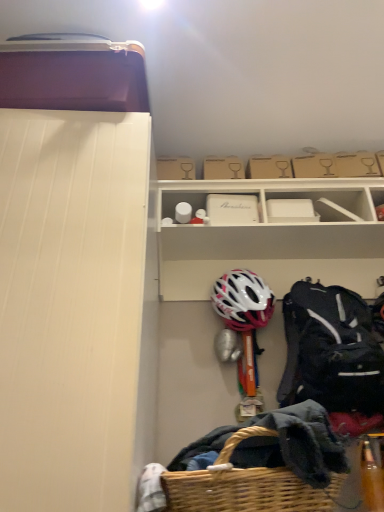
Question: Should I look upward or downward to see white matte helmet at center?

Choices:
 (A) up
 (B) down

Answer: (B)

Question: Does woven brown picnic basket at lower center appear on the left side of white matte storage box at upper center, the second storage box positioned from the top?

Choices:
 (A) no
 (B) yes

Answer: (B)

Question: Does woven brown picnic basket at lower center have a smaller size compared to white matte storage box at upper center, the second storage box positioned from the top?

Choices:
 (A) yes
 (B) no

Answer: (B)

Question: From a real-world perspective, is woven brown picnic basket at lower center physically above white matte storage box at upper center, the second storage box positioned from the top?

Choices:
 (A) no
 (B) yes

Answer: (A)

Question: Considering the relative positions of woven brown picnic basket at lower center and white matte storage box at upper center, the first storage box when ordered from bottom to top, in the image provided, is woven brown picnic basket at lower center in front of white matte storage box at upper center, the first storage box when ordered from bottom to top,?

Choices:
 (A) yes
 (B) no

Answer: (A)

Question: Can you confirm if woven brown picnic basket at lower center is thinner than white matte storage box at upper center, the first storage box when ordered from bottom to top?

Choices:
 (A) no
 (B) yes

Answer: (A)

Question: From a real-world perspective, is woven brown picnic basket at lower center beneath white matte storage box at upper center, the first storage box when ordered from bottom to top?

Choices:
 (A) no
 (B) yes

Answer: (B)

Question: Is black synthetic backpack at right looking in the opposite direction of brown cardboard box at upper center, which is the 1th storage box in top-to-bottom order?

Choices:
 (A) yes
 (B) no

Answer: (B)

Question: Can you confirm if black synthetic backpack at right is positioned to the right of brown cardboard box at upper center, which is the 1th storage box in top-to-bottom order?

Choices:
 (A) yes
 (B) no

Answer: (A)

Question: From a real-world perspective, is black synthetic backpack at right beneath brown cardboard box at upper center, which is the 1th storage box in top-to-bottom order?

Choices:
 (A) no
 (B) yes

Answer: (B)

Question: From a real-world perspective, is black synthetic backpack at right located higher than brown cardboard box at upper center, which is the 2th storage box in bottom-to-top order?

Choices:
 (A) yes
 (B) no

Answer: (B)

Question: Is black synthetic backpack at right smaller than brown cardboard box at upper center, which is the 2th storage box in bottom-to-top order?

Choices:
 (A) no
 (B) yes

Answer: (A)

Question: Considering the relative sizes of black synthetic backpack at right and brown cardboard box at upper center, which is the 1th storage box in top-to-bottom order, in the image provided, is black synthetic backpack at right thinner than brown cardboard box at upper center, which is the 1th storage box in top-to-bottom order,?

Choices:
 (A) yes
 (B) no

Answer: (B)

Question: From the image's perspective, is white matte storage box at upper center, the first storage box when ordered from bottom to top, on brown cardboard box at upper center, which is the 1th storage box in top-to-bottom order?

Choices:
 (A) no
 (B) yes

Answer: (A)